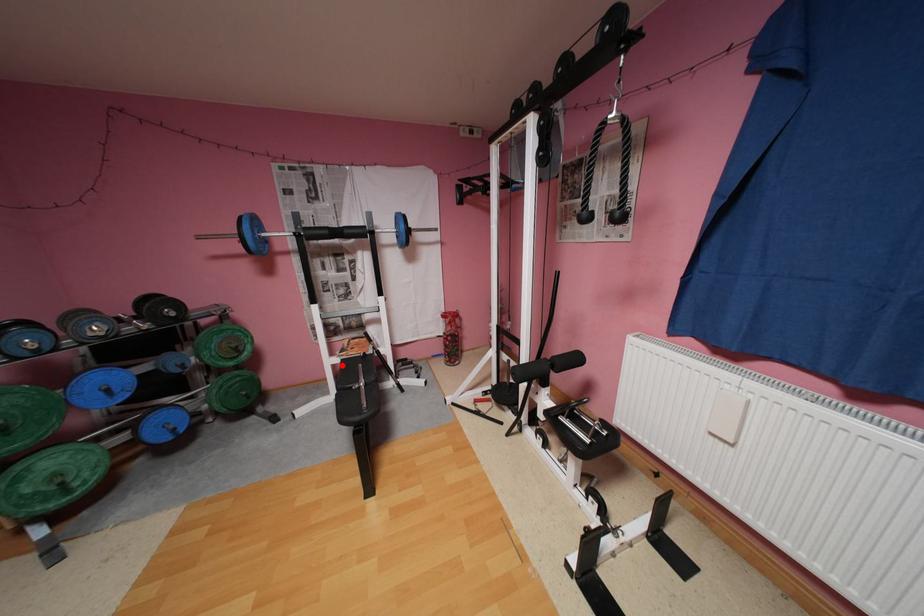
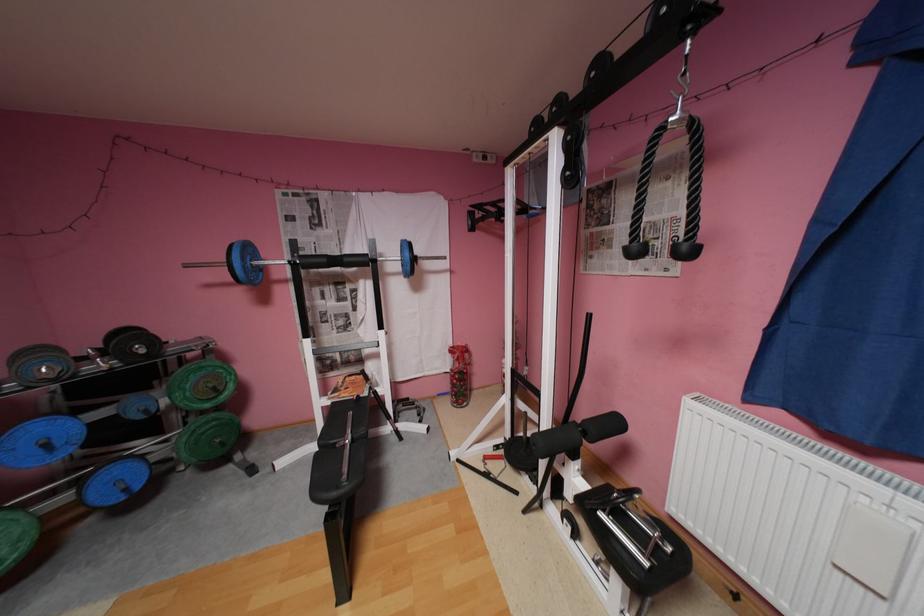
Find the pixel in the second image that matches the highlighted location in the first image.

(333, 408)